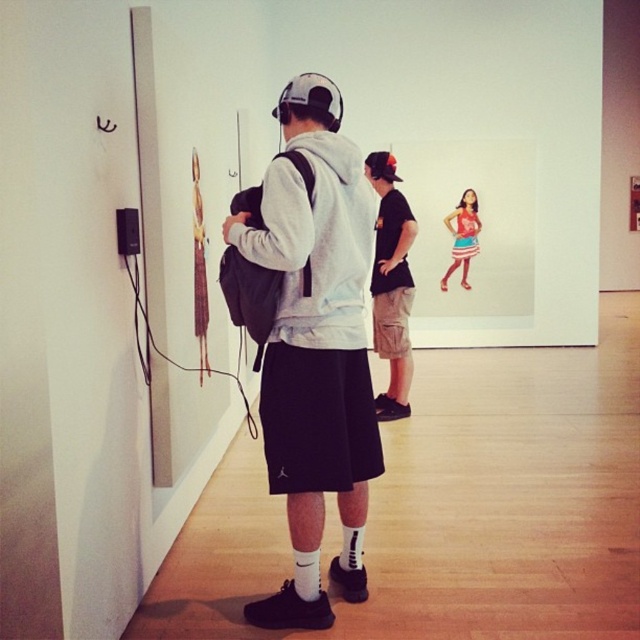
Does matte gray hoodie at center have a smaller size compared to black cotton t-shirt at center?

No, matte gray hoodie at center is not smaller than black cotton t-shirt at center.

Is matte gray hoodie at center to the right of black cotton t-shirt at center from the viewer's perspective?

In fact, matte gray hoodie at center is to the left of black cotton t-shirt at center.

The image size is (640, 640). In order to click on matte gray hoodie at center in this screenshot , I will do `click(308, 340)`.

Does matte gray hoodie at center come in front of matte pink dress at center?

Yes, matte gray hoodie at center is in front of matte pink dress at center.

Between matte gray hoodie at center and matte pink dress at center, which one has more height?

With more height is matte gray hoodie at center.

Is point (300, 525) less distant than point (474, 252)?

Yes, it is.

At what (x,y) coordinates should I click in order to perform the action: click on matte gray hoodie at center. Please return your answer as a coordinate pair (x, y). The width and height of the screenshot is (640, 640). Looking at the image, I should click on (308, 340).

Between black cotton t-shirt at center and matte pink dress at center, which one has less height?

Standing shorter between the two is matte pink dress at center.

Is point (394, 404) more distant than point (474, 209)?

No, it is not.

Where is `black cotton t-shirt at center`? The image size is (640, 640). black cotton t-shirt at center is located at coordinates (392, 284).